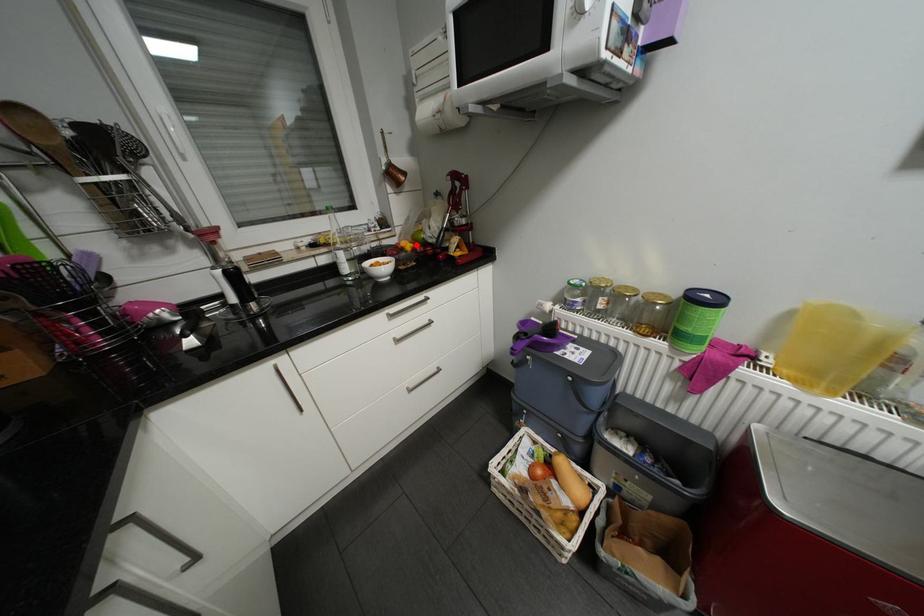
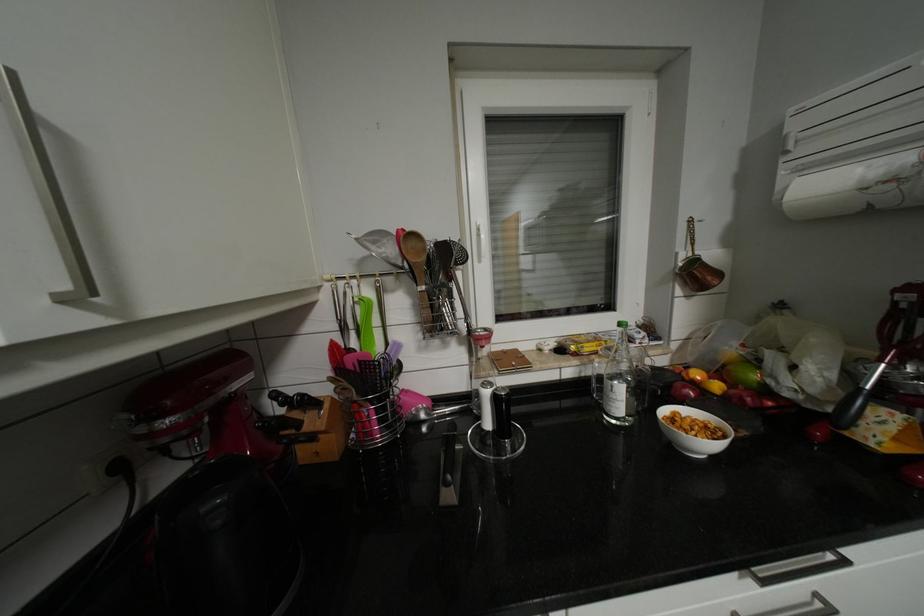
In the second image, find the point that corresponds to the highlighted location in the first image.

(724, 386)